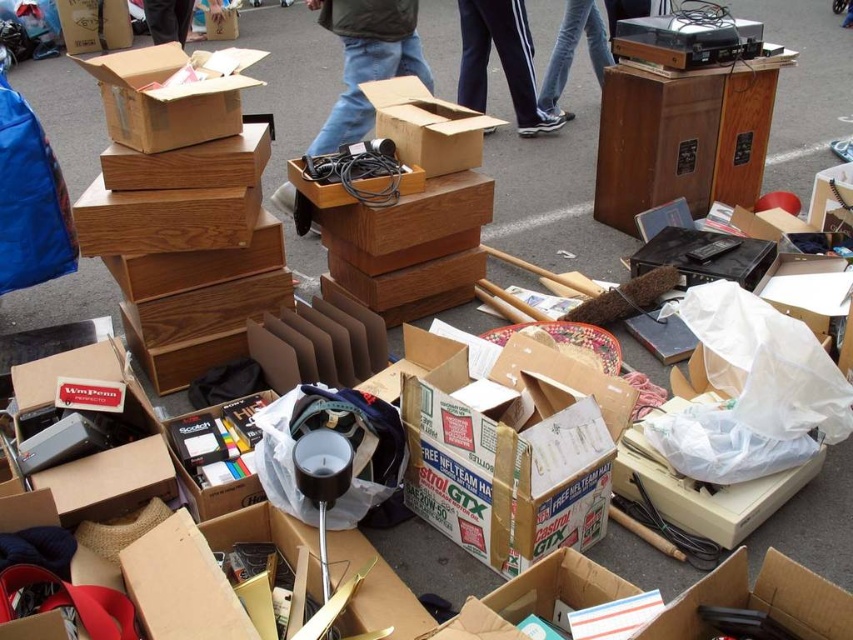
Consider the image. You are setting up a display for a flea market booth. You have a matte cardboard box at center and dark blue jeans at upper center. Which item should you place on the lower shelf if you want to follow the rule of putting larger items lower?

The matte cardboard box at center is larger in size than the dark blue jeans at upper center, so you should place the matte cardboard box at center on the lower shelf to follow the rule.

You are a customer looking for a pair of jeans to try on. You see two pairs of jeans in the image, the dark blue jeans at center and the jeans at upper center. Which pair is closer to the ground?

The dark blue jeans at center is positioned under the jeans at upper center, so the dark blue jeans at center is closer to the ground.